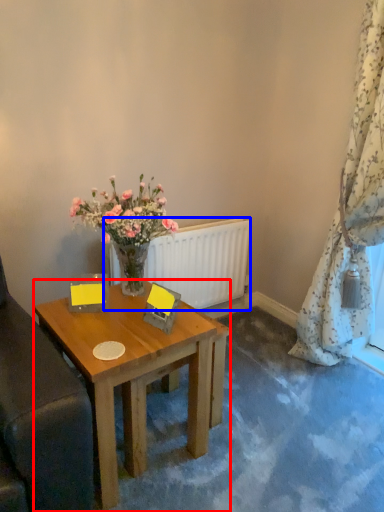
Question: Among these objects, which one is farthest to the camera, desk (highlighted by a red box) or radiator (highlighted by a blue box)?

Choices:
 (A) desk
 (B) radiator

Answer: (B)